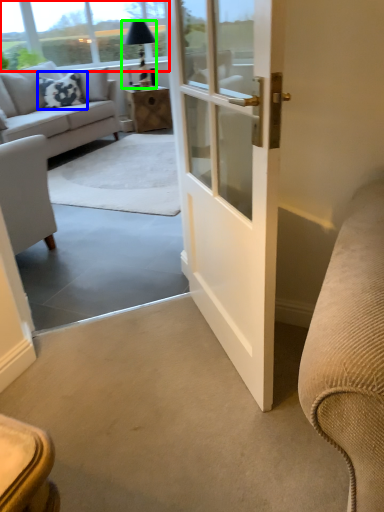
Question: Considering the real-world distances, which object is farthest from window screen (highlighted by a red box)? pillow (highlighted by a blue box) or lamp (highlighted by a green box)?

Choices:
 (A) pillow
 (B) lamp

Answer: (A)